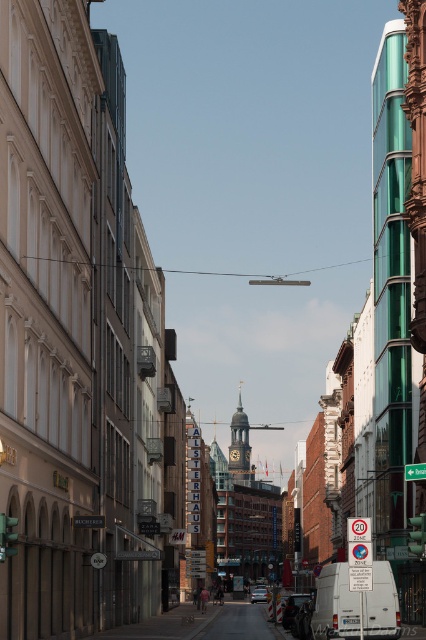
The image size is (426, 640). Find the location of `metallic silver van at center`. metallic silver van at center is located at coordinates (293, 609).

Is point (293, 620) farther from viewer compared to point (262, 593)?

No, it is in front of (262, 593).

The width and height of the screenshot is (426, 640). Describe the element at coordinates (293, 609) in the screenshot. I see `metallic silver van at center` at that location.

Identify the location of metallic silver van at center. The height and width of the screenshot is (640, 426). (293, 609).

From the picture: Is gold textured clock tower at center taller than metallic silver van at center?

Yes.

Is point (249, 449) positioned after point (282, 616)?

Yes, it is.

This screenshot has width=426, height=640. In order to click on gold textured clock tower at center in this screenshot , I will do `click(239, 445)`.

Who is higher up, gold textured clock tower at center or silver metallic car at center?

Positioned higher is gold textured clock tower at center.

Is point (239, 451) positioned before point (259, 593)?

That is False.

Locate an element on the screen. This screenshot has height=640, width=426. gold textured clock tower at center is located at coordinates (239, 445).